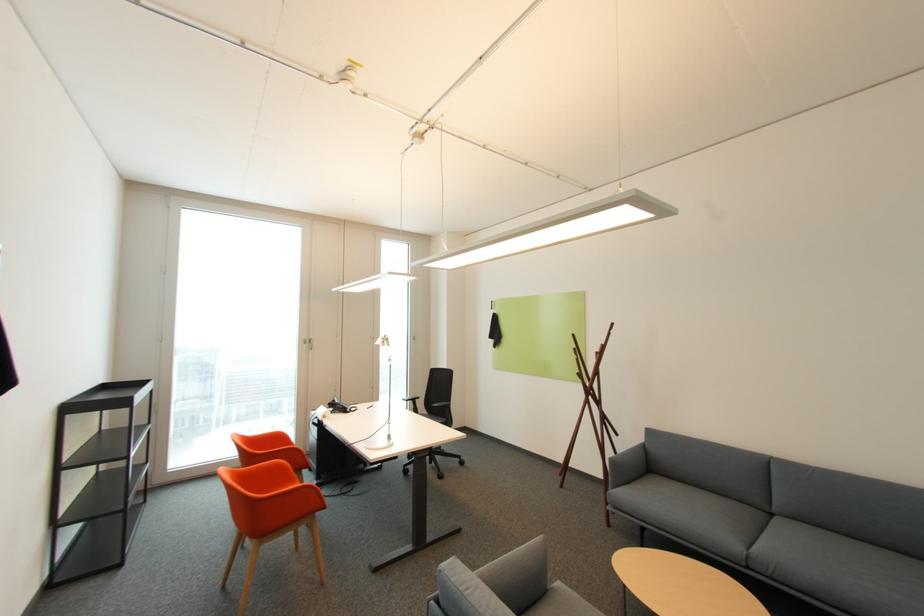
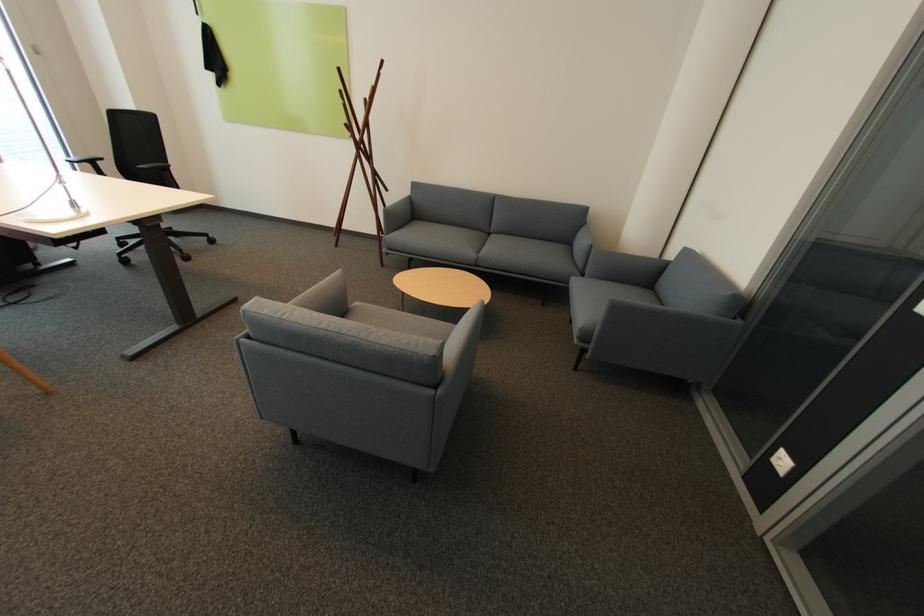
Locate, in the second image, the point that corresponds to (440,406) in the first image.

(146, 167)